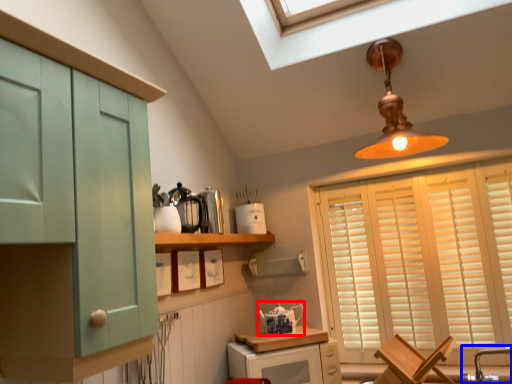
Question: Which point is further to the camera, tea pot (highlighted by a red box) or faucet (highlighted by a blue box)?

Choices:
 (A) tea pot
 (B) faucet

Answer: (A)